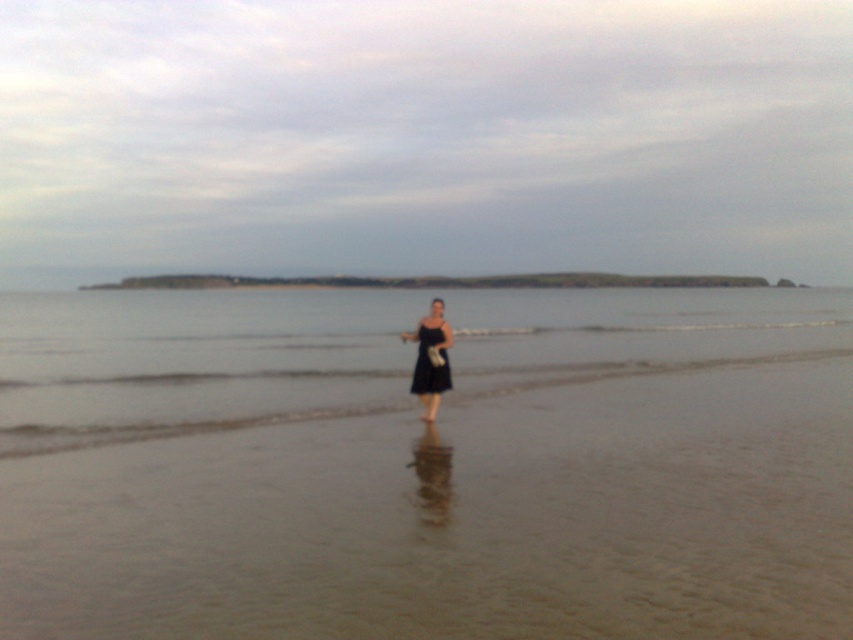
You are standing on the beach and see the clear water at center and the black matte dress at center. Which one is taller?

The clear water at center is taller than the black matte dress at center.

You are standing on the beach and notice two points marked on the sand. The first point is at coordinates point (438, 387), and the second is at point (444, 387). Which point is closer to you?

Point (438, 387) is closer to the camera than point (444, 387).

You are standing on the beach and want to take a photo of both the clear water at center and the black matte dress at center. Which object should you focus on first to ensure both are in sharp focus?

You should focus on the black matte dress at center first because it is farther away from the viewer than the clear water at center, so adjusting focus from there will help both objects be in sharp focus.